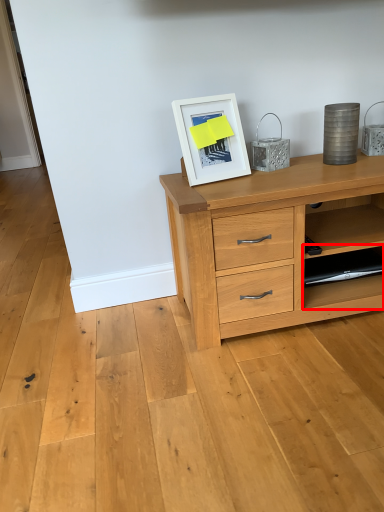
Question: Where is shelf (annotated by the red box) located in relation to picture frame in the image?

Choices:
 (A) left
 (B) right

Answer: (B)